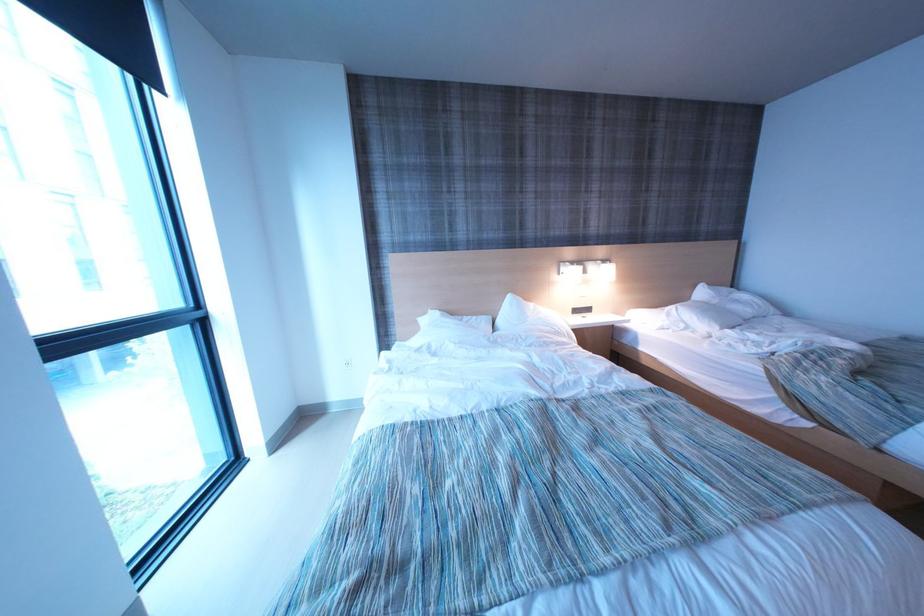
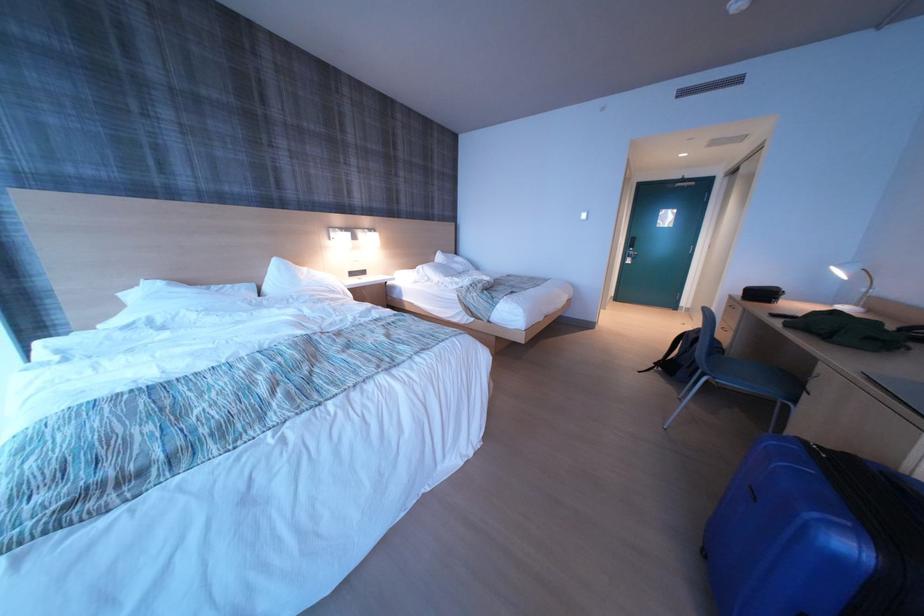
Question: The camera is either moving clockwise (left) or counter-clockwise (right) around the object. The first image is from the beginning of the video and the second image is from the end. Is the camera moving left or right when shooting the video?

Choices:
 (A) Left
 (B) Right

Answer: (A)